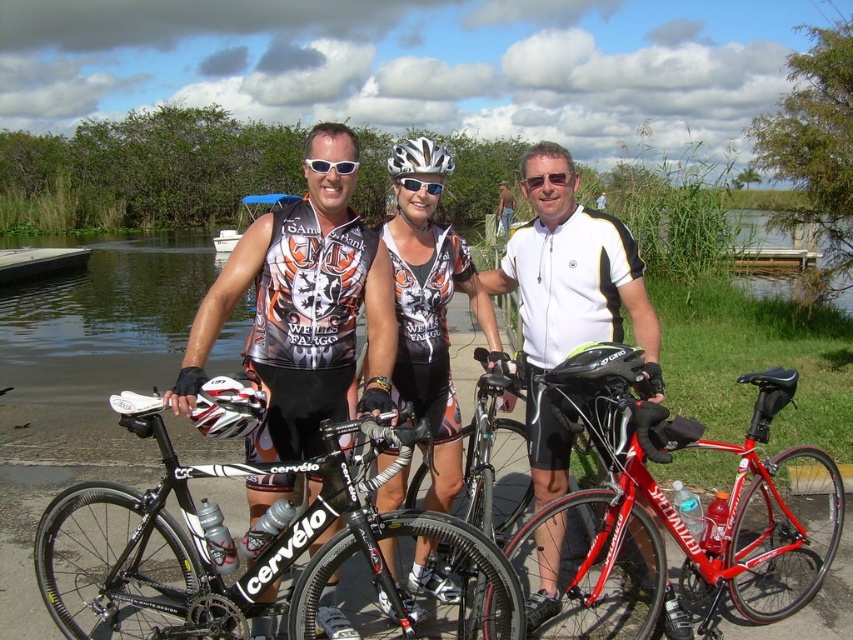
Question: Which object is positioned closest to the white matte goggles at center?

Choices:
 (A) shiny black cycling jersey at center
 (B) black matte bicycle at center
 (C) white matte jersey at center

Answer: (A)

Question: Can you confirm if matte black cycling jersey at center is bigger than white matte goggles at center?

Choices:
 (A) yes
 (B) no

Answer: (A)

Question: Can you confirm if shiny black cycling jersey at center is positioned to the right of shiny silver helmet at center?

Choices:
 (A) yes
 (B) no

Answer: (B)

Question: Which of the following is the closest to the observer?

Choices:
 (A) (675, 289)
 (B) (131, 532)
 (C) (654, 552)

Answer: (C)

Question: Considering the relative positions of shiny black cycling jersey at center and white matte goggles at center in the image provided, where is shiny black cycling jersey at center located with respect to white matte goggles at center?

Choices:
 (A) right
 (B) left

Answer: (B)

Question: Which point is farther to the camera?

Choices:
 (A) (498, 230)
 (B) (350, 164)
 (C) (86, 372)
 (D) (332, 474)

Answer: (A)